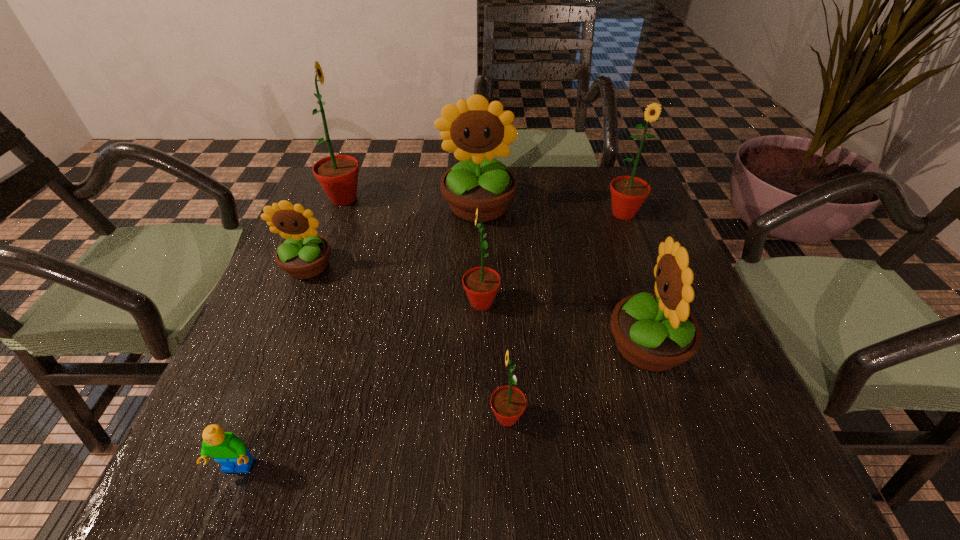
The image size is (960, 540). What are the coordinates of `free spot between the farthest yellow sunflower and the third biggest green sunflower` in the screenshot? It's located at (480, 255).

You are a GUI agent. You are given a task and a screenshot of the screen. Output one action in this format:
    pyautogui.click(x=<x>, y=<y>)
    Task: Click on the vacant space that is in between the second yellow sunflower from right to left and the Lego
    
    Given the screenshot: What is the action you would take?
    pyautogui.click(x=358, y=337)

The width and height of the screenshot is (960, 540). I want to click on free space that is in between the smallest green sunflower and the second biggest green sunflower, so click(565, 315).

Find the location of a particular element. free area in between the rightmost green sunflower and the leftmost yellow sunflower is located at coordinates (466, 240).

This screenshot has height=540, width=960. Identify the location of free spot between the second nearest green sunflower and the leftmost yellow sunflower. (395, 285).

Locate an element on the screen. The width and height of the screenshot is (960, 540). free space between the Lego and the rightmost green sunflower is located at coordinates (431, 341).

I want to click on blank region between the green Lego and the second biggest yellow sunflower, so click(x=443, y=407).

Identify which object is located as the third nearest to the nearest yellow sunflower. Please provide its 2D coordinates. Your answer should be formatted as a tuple, i.e. [(x, y)], where the tuple contains the x and y coordinates of a point satisfying the conditions above.

[(628, 193)]

Locate which object ranks second in proximity to the second smallest green sunflower. Please provide its 2D coordinates. Your answer should be formatted as a tuple, i.e. [(x, y)], where the tuple contains the x and y coordinates of a point satisfying the conditions above.

[(655, 332)]

Select which sunflower appears as the sixth closest to the third smallest green sunflower. Please provide its 2D coordinates. Your answer should be formatted as a tuple, i.e. [(x, y)], where the tuple contains the x and y coordinates of a point satisfying the conditions above.

[(304, 254)]